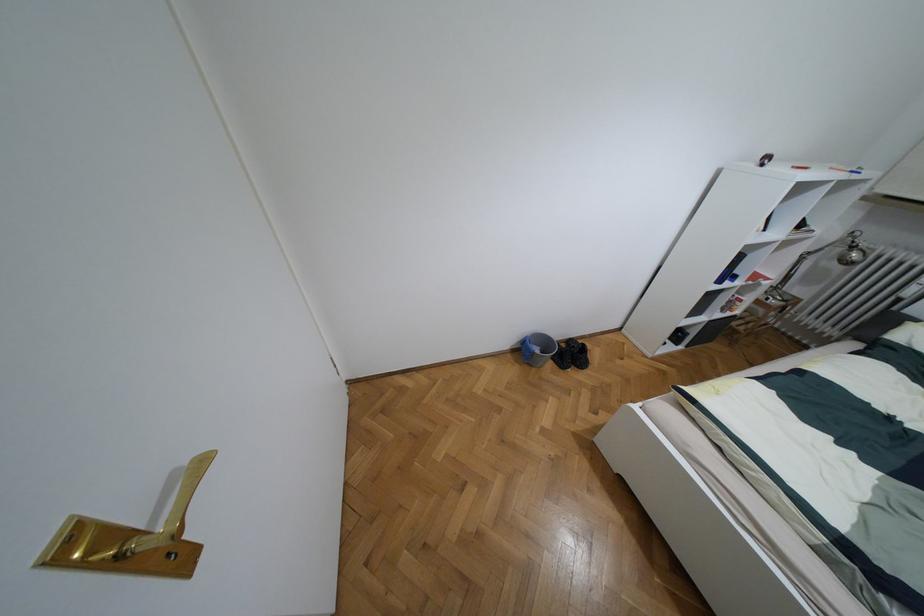
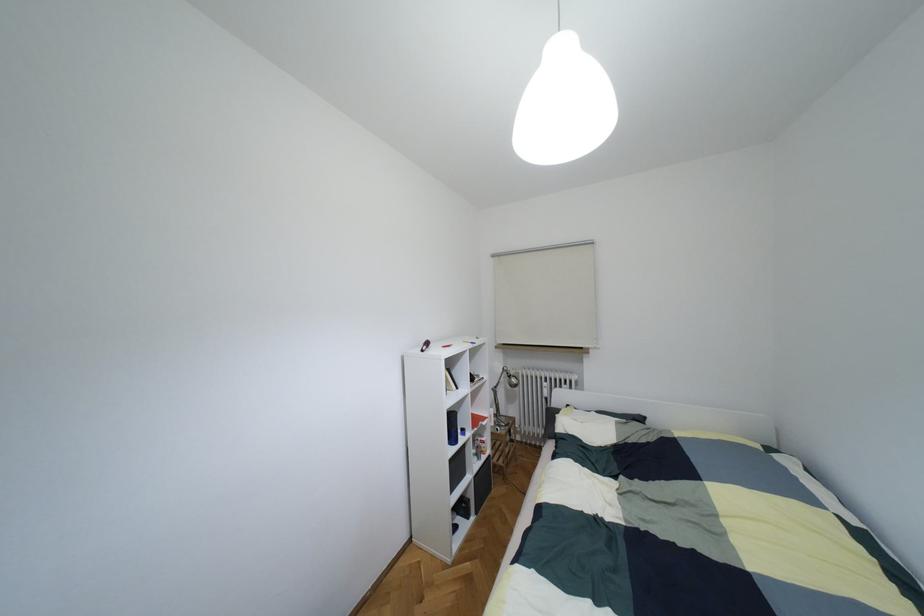
In the second image, find the point that corresponds to point 852,246 in the first image.

(508, 376)